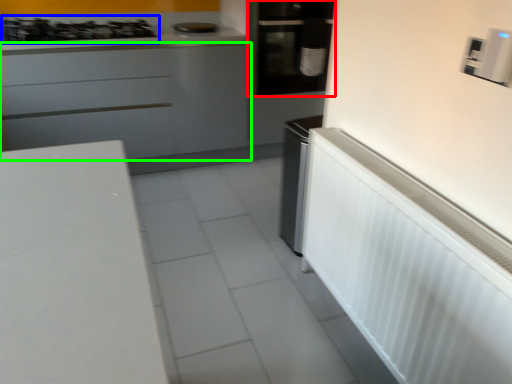
Question: Which object is the farthest from home appliance (highlighted by a red box)? Choose among these: gas stove (highlighted by a blue box) or cabinetry (highlighted by a green box).

Choices:
 (A) gas stove
 (B) cabinetry

Answer: (A)